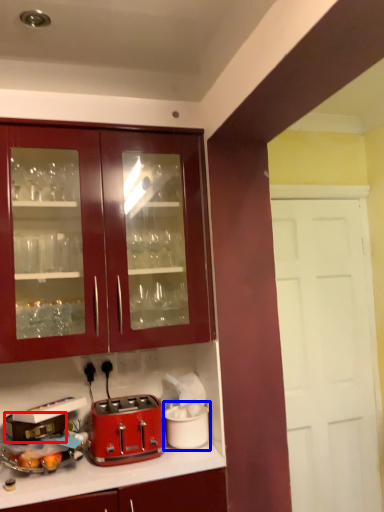
Question: Which of the following is the farthest to the observer, appliance (highlighted by a red box) or appliance (highlighted by a blue box)?

Choices:
 (A) appliance
 (B) appliance

Answer: (B)